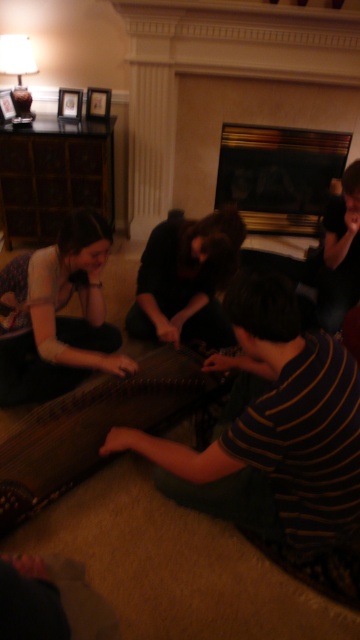
Can you confirm if wooden harp at center is wider than matte black dress at lower left?

Yes, wooden harp at center is wider than matte black dress at lower left.

Is wooden harp at center bigger than matte black dress at lower left?

Correct, wooden harp at center is larger in size than matte black dress at lower left.

Where is `wooden harp at center`? The image size is (360, 640). wooden harp at center is located at coordinates (275, 424).

Can you confirm if wooden harp at center is smaller than black glass fireplace at upper center?

Incorrect, wooden harp at center is not smaller in size than black glass fireplace at upper center.

Identify the location of wooden harp at center. This screenshot has height=640, width=360. (275, 424).

What do you see at coordinates (275, 424) in the screenshot? I see `wooden harp at center` at bounding box center [275, 424].

Locate an element on the screen. wooden harp at center is located at coordinates point(275,424).

Is wooden harp at center bigger than dark brown leather guitar at center?

Yes, wooden harp at center is bigger than dark brown leather guitar at center.

Who is more distant from viewer, (x=280, y=348) or (x=162, y=273)?

Point (x=162, y=273)

Between point (246, 451) and point (231, 246), which one is positioned in front?

Positioned in front is point (246, 451).

The height and width of the screenshot is (640, 360). What are the coordinates of `wooden harp at center` in the screenshot? It's located at (275, 424).